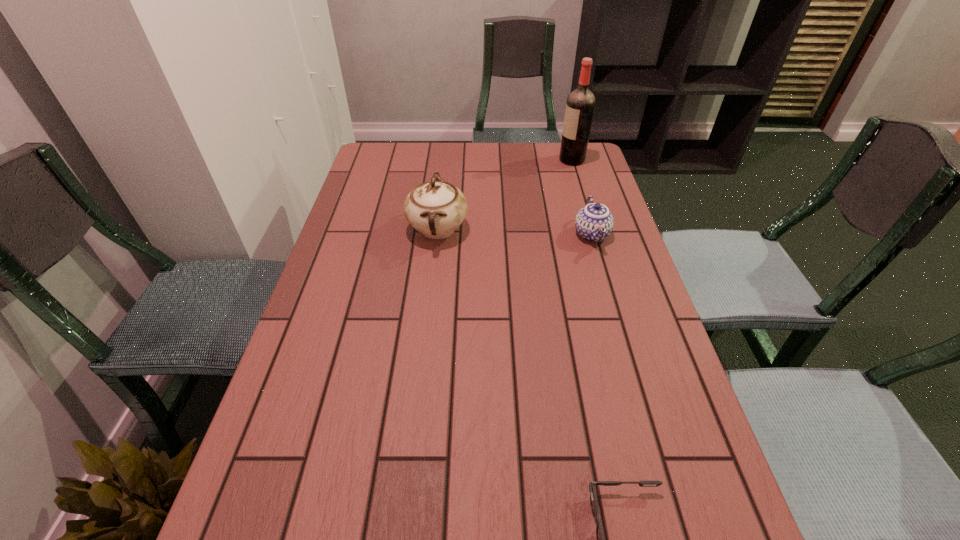
Identify the location of the tallest object. (580, 104).

Where is `the farthest object`? The height and width of the screenshot is (540, 960). the farthest object is located at coordinates (580, 104).

You are a GUI agent. You are given a task and a screenshot of the screen. Output one action in this format:
    pyautogui.click(x=<x>, y=<y>)
    Task: Click on the leftmost object
    
    Given the screenshot: What is the action you would take?
    pyautogui.click(x=436, y=208)

I want to click on the left chinaware, so click(x=436, y=208).

Find the location of `the second shortest object`. the second shortest object is located at coordinates (594, 222).

At what (x,y) coordinates should I click in order to perform the action: click on the shorter chinaware. Please return your answer as a coordinate pair (x, y). Looking at the image, I should click on (594, 222).

This screenshot has width=960, height=540. In order to click on vacant area located 0.100m on the front-facing side of the liquor in this screenshot , I will do [x=531, y=160].

The image size is (960, 540). I want to click on vacant space located on the front-facing side of the liquor, so click(x=545, y=160).

In order to click on blank area located on the front-facing side of the liquor in this screenshot , I will do `click(537, 160)`.

The height and width of the screenshot is (540, 960). Find the location of `free point located on the back of the taller chinaware`. free point located on the back of the taller chinaware is located at coordinates tap(445, 159).